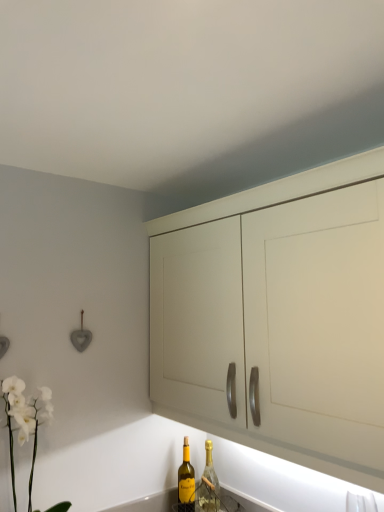
Question: In terms of width, does matte white cabinet at center look wider or thinner when compared to white matte orchid at lower left?

Choices:
 (A) thin
 (B) wide

Answer: (B)

Question: Is matte white cabinet at center taller or shorter than white matte orchid at lower left?

Choices:
 (A) short
 (B) tall

Answer: (B)

Question: Which object is the closest to the white matte orchid at lower left?

Choices:
 (A) matte white cabinet at center
 (B) yellow glass bottle at lower center, which is the 1th bottle from left to right
 (C) gold foil champagne bottle at lower center, which is the first bottle in right-to-left order

Answer: (B)

Question: Based on their relative distances, which object is farther from the gold foil champagne bottle at lower center, which is the first bottle in right-to-left order?

Choices:
 (A) white matte orchid at lower left
 (B) yellow glass bottle at lower center, marked as the 2th bottle in a right-to-left arrangement
 (C) matte white cabinet at center

Answer: (C)